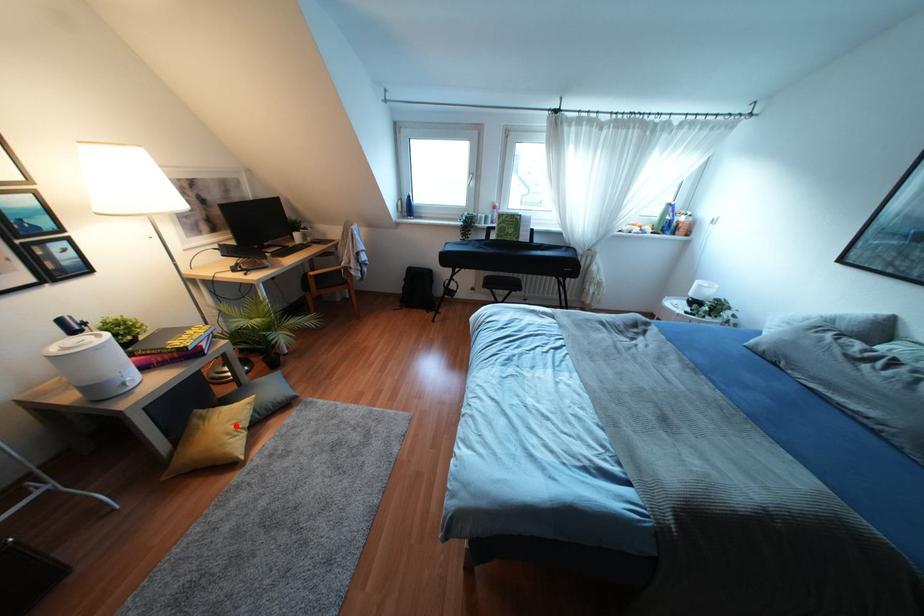
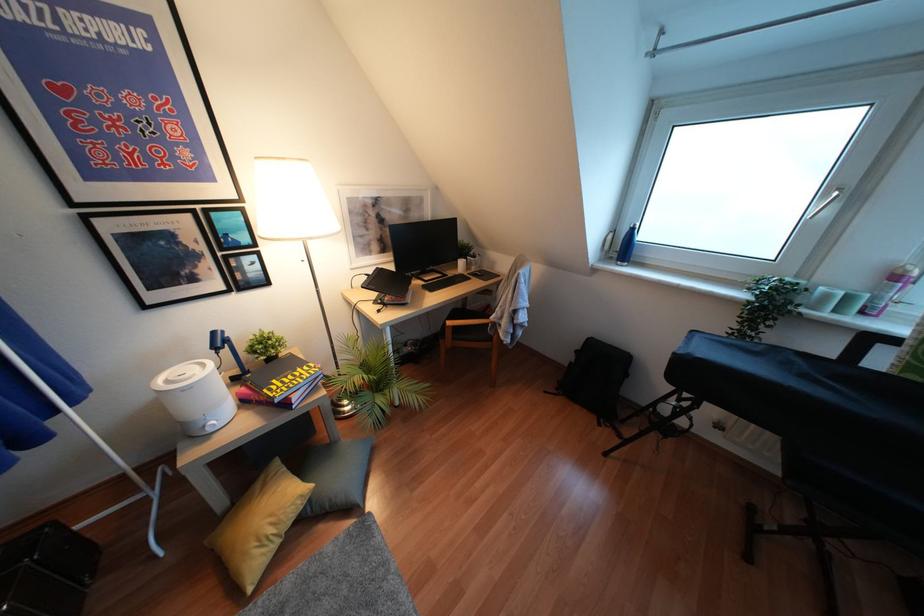
Question: I am providing you with two images of the same scene from different viewpoints. Image1 has a red point marked. In image2, the corresponding 3D location appears at what relative position? Reply with the corresponding letter.

Choices:
 (A) Closer
 (B) Farther

Answer: (B)